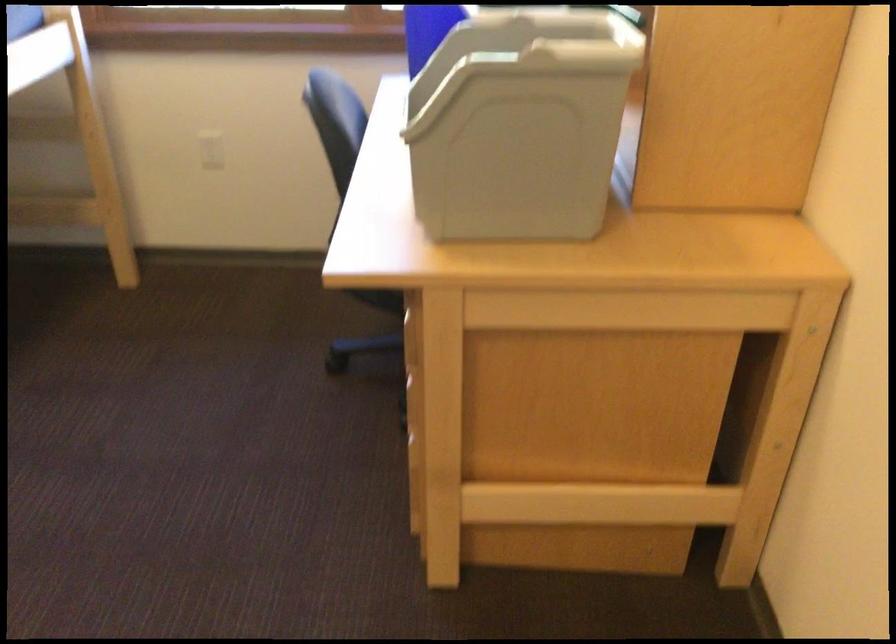
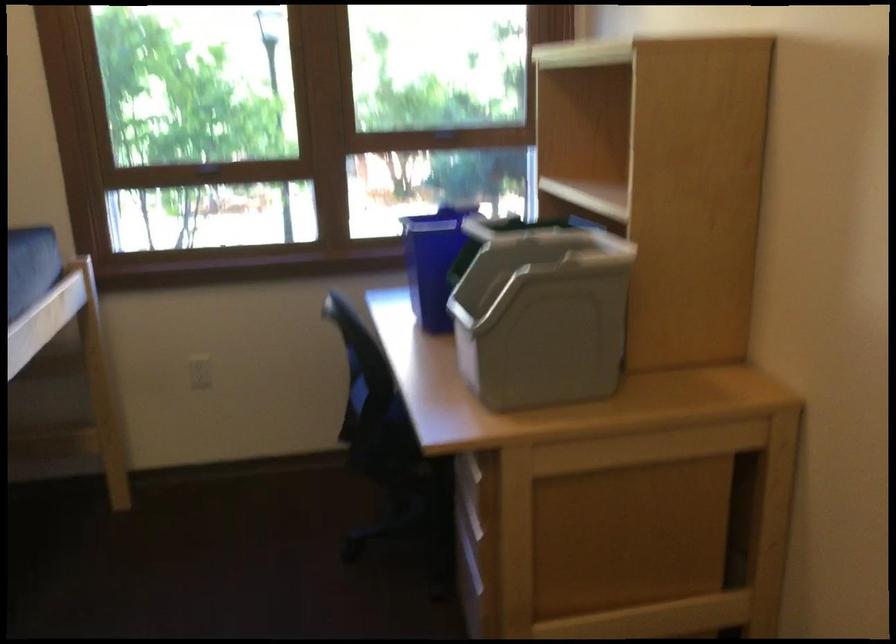
Question: The first image is from the beginning of the video and the second image is from the end. How did the camera likely rotate when shooting the video?

Choices:
 (A) Left
 (B) Right
 (C) Up
 (D) Down

Answer: (C)